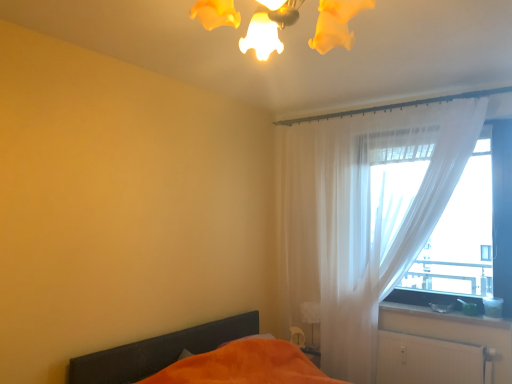
This screenshot has width=512, height=384. Describe the element at coordinates (461, 235) in the screenshot. I see `translucent fabric at right` at that location.

I want to click on sheer white curtain at right, so click(x=364, y=215).

Identify the location of orange fabric bed at lower left. (200, 358).

This screenshot has width=512, height=384. In order to click on smooth white surface at lower right in this screenshot , I will do `click(444, 315)`.

The height and width of the screenshot is (384, 512). What are the coordinates of `translucent fabric at right` in the screenshot? It's located at click(x=461, y=235).

Considering the positions of points (454, 312) and (433, 290), is point (454, 312) closer to camera compared to point (433, 290)?

Yes, it is.

Where is `window behind the smooth white surface at lower right`? The image size is (512, 384). window behind the smooth white surface at lower right is located at coordinates (461, 235).

Measure the distance between smooth white surface at lower right and translucent fabric at right.

smooth white surface at lower right is 23.29 inches from translucent fabric at right.

Can you see white glossy table lamp at lower right touching sheer white curtain at right?

white glossy table lamp at lower right is not next to sheer white curtain at right, and they're not touching.

Considering the sizes of objects white glossy table lamp at lower right and sheer white curtain at right in the image provided, who is smaller, white glossy table lamp at lower right or sheer white curtain at right?

white glossy table lamp at lower right.

Considering the relative positions of white glossy table lamp at lower right and sheer white curtain at right in the image provided, is white glossy table lamp at lower right to the right of sheer white curtain at right from the viewer's perspective?

No.

Can we say white glossy table lamp at lower right lies outside sheer white curtain at right?

That's incorrect, white glossy table lamp at lower right is not completely outside sheer white curtain at right.

Where is `table lamp on the right of the matte yellow lampshade at upper center`? Image resolution: width=512 pixels, height=384 pixels. table lamp on the right of the matte yellow lampshade at upper center is located at coordinates (311, 316).

Considering the sizes of white glossy table lamp at lower right and matte yellow lampshade at upper center in the image, is white glossy table lamp at lower right bigger or smaller than matte yellow lampshade at upper center?

Clearly, white glossy table lamp at lower right is smaller in size than matte yellow lampshade at upper center.

Is white glossy table lamp at lower right at the right side of matte yellow lampshade at upper center?

Yes.

Considering the points (314, 307) and (313, 46), which point is behind, point (314, 307) or point (313, 46)?

Point (314, 307)

Consider the image. Is sheer white curtain at right oriented away from white glossy table lamp at lower right?

Absolutely, sheer white curtain at right is directed away from white glossy table lamp at lower right.

Does sheer white curtain at right come in front of white glossy table lamp at lower right?

Yes, it is in front of white glossy table lamp at lower right.

Where is `table lamp below the sheer white curtain at right (from the image's perspective)`? table lamp below the sheer white curtain at right (from the image's perspective) is located at coordinates (311, 316).

Considering the relative positions of sheer white curtain at right and orange fabric bed at lower left in the image provided, is sheer white curtain at right to the right of orange fabric bed at lower left from the viewer's perspective?

Correct, you'll find sheer white curtain at right to the right of orange fabric bed at lower left.

Would you say sheer white curtain at right is inside or outside orange fabric bed at lower left?

sheer white curtain at right is located beyond the bounds of orange fabric bed at lower left.

How many degrees apart are the facing directions of sheer white curtain at right and orange fabric bed at lower left?

The angle between the facing direction of sheer white curtain at right and the facing direction of orange fabric bed at lower left is 90 degrees.

Is sheer white curtain at right thinner than orange fabric bed at lower left?

Correct, the width of sheer white curtain at right is less than that of orange fabric bed at lower left.

Based on the photo, considering the sizes of objects translucent fabric at right and smooth white surface at lower right in the image provided, who is smaller, translucent fabric at right or smooth white surface at lower right?

smooth white surface at lower right is smaller.

Is point (381, 188) closer or farther from the camera than point (432, 316)?

Clearly, point (381, 188) is more distant from the camera than point (432, 316).

Does translucent fabric at right appear on the left side of smooth white surface at lower right?

No.

Is smooth white surface at lower right oriented towards matte yellow lampshade at upper center?

No, smooth white surface at lower right is not facing towards matte yellow lampshade at upper center.

In order to click on window sill directly beneath the matte yellow lampshade at upper center (from a real-world perspective) in this screenshot , I will do `click(444, 315)`.

Can you tell me how much smooth white surface at lower right and matte yellow lampshade at upper center differ in facing direction?

The angular difference between smooth white surface at lower right and matte yellow lampshade at upper center is 2.95 degrees.

This screenshot has width=512, height=384. What are the coordinates of `window sill beneath the translucent fabric at right (from a real-world perspective)` in the screenshot? It's located at (444, 315).

Image resolution: width=512 pixels, height=384 pixels. In order to click on table lamp on the left of sheer white curtain at right in this screenshot , I will do `click(311, 316)`.

Based on their spatial positions, is orange fabric bed at lower left or sheer white curtain at right closer to smooth white surface at lower right?

sheer white curtain at right lies closer to smooth white surface at lower right than the other object.

Which object lies further to the anchor point white textured radiator at lower right, smooth white surface at lower right or sheer white curtain at right?

sheer white curtain at right is further to white textured radiator at lower right.

Based on their spatial positions, is matte yellow lampshade at upper center or smooth white surface at lower right further from white glossy table lamp at lower right?

matte yellow lampshade at upper center.

Which object lies further to the anchor point smooth white surface at lower right, white textured radiator at lower right or translucent fabric at right?

translucent fabric at right.

When comparing their distances from smooth white surface at lower right, does white textured radiator at lower right or white glossy table lamp at lower right seem further?

Among the two, white glossy table lamp at lower right is located further to smooth white surface at lower right.

Considering their positions, is matte yellow lampshade at upper center positioned further to orange fabric bed at lower left than sheer white curtain at right?

matte yellow lampshade at upper center lies further to orange fabric bed at lower left than the other object.

From the image, which object appears to be farther from white glossy table lamp at lower right, sheer white curtain at right or smooth white surface at lower right?

sheer white curtain at right.

Considering their positions, is white textured radiator at lower right positioned further to smooth white surface at lower right than matte yellow lampshade at upper center?

Among the two, matte yellow lampshade at upper center is located further to smooth white surface at lower right.

Find the location of a particular element. The image size is (512, 384). window sill that lies between sheer white curtain at right and white textured radiator at lower right from top to bottom is located at coordinates (444, 315).

Find the location of `radiator between white glossy table lamp at lower right and smooth white surface at lower right`. radiator between white glossy table lamp at lower right and smooth white surface at lower right is located at coordinates (429, 360).

Where is `bed between matte yellow lampshade at upper center and white glossy table lamp at lower right in the front-back direction`? The height and width of the screenshot is (384, 512). bed between matte yellow lampshade at upper center and white glossy table lamp at lower right in the front-back direction is located at coordinates (200, 358).

Identify the location of bed between matte yellow lampshade at upper center and smooth white surface at lower right along the z-axis. (200, 358).